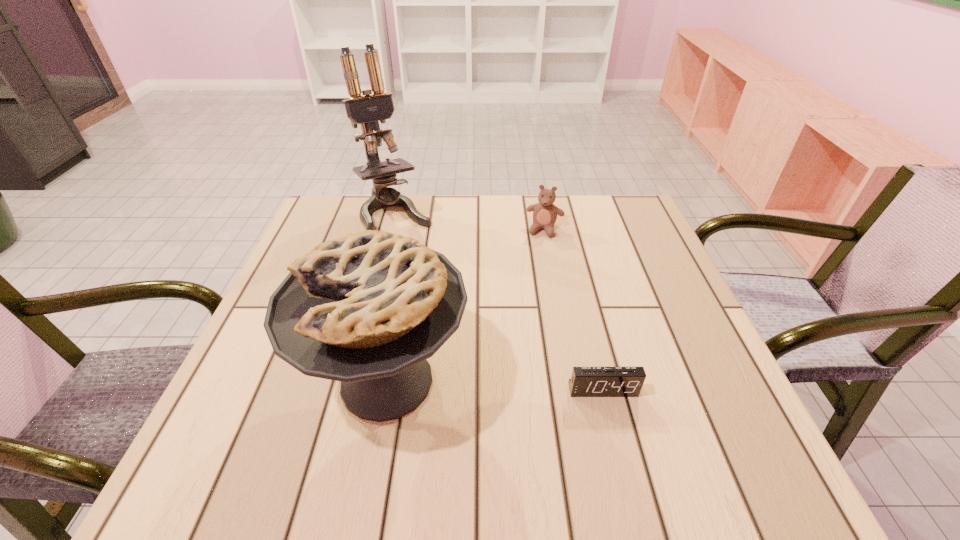
Locate an element on the screen. pie is located at coordinates (367, 309).

In order to click on alarm clock in this screenshot , I will do `click(585, 381)`.

This screenshot has width=960, height=540. Find the location of `teddy bear`. teddy bear is located at coordinates (545, 213).

Where is `the tallest object`? the tallest object is located at coordinates (367, 110).

The height and width of the screenshot is (540, 960). What are the coordinates of `free space located on the cut side of the second tallest object` in the screenshot? It's located at (260, 381).

Find the location of a particular element. vacant space located on the cut side of the second tallest object is located at coordinates (244, 381).

This screenshot has height=540, width=960. What are the coordinates of `free point located on the cut side of the second tallest object` in the screenshot? It's located at (238, 381).

The width and height of the screenshot is (960, 540). I want to click on free space located 0.060m on the front-facing side of the teddy bear, so click(x=538, y=253).

Identify the location of vacant region located on the front-facing side of the teddy bear. (526, 295).

You are a GUI agent. You are given a task and a screenshot of the screen. Output one action in this format:
    pyautogui.click(x=<x>, y=<y>)
    Task: Click on the vacant space located 0.200m on the front-facing side of the teddy bear
    
    Given the screenshot: What is the action you would take?
    pyautogui.click(x=528, y=289)